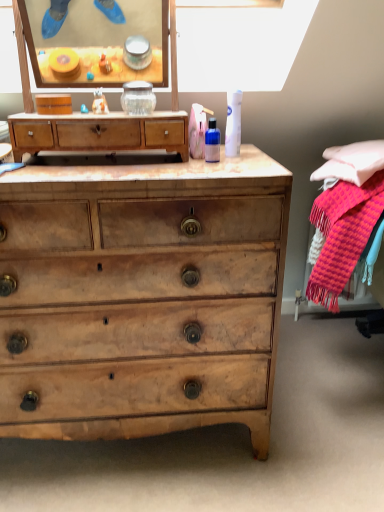
You are a GUI agent. You are given a task and a screenshot of the screen. Output one action in this format:
    pyautogui.click(x=<x>, y=<y>)
    Task: Click on the empty space that is to the right of light brown wood chest of drawers at center, which is the first chest of drawers in bottom-to-top order
    The image size is (384, 512).
    Given the screenshot: What is the action you would take?
    (313, 409)